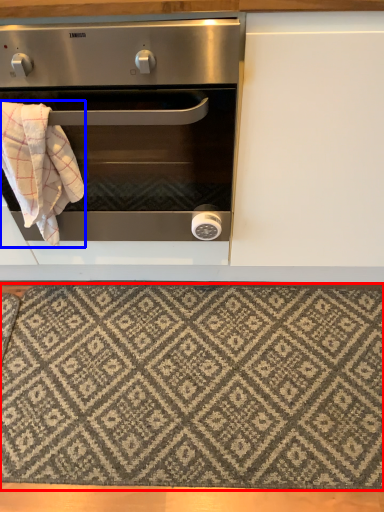
Question: Among these objects, which one is farthest to the camera, mat (highlighted by a red box) or blanket (highlighted by a blue box)?

Choices:
 (A) mat
 (B) blanket

Answer: (A)